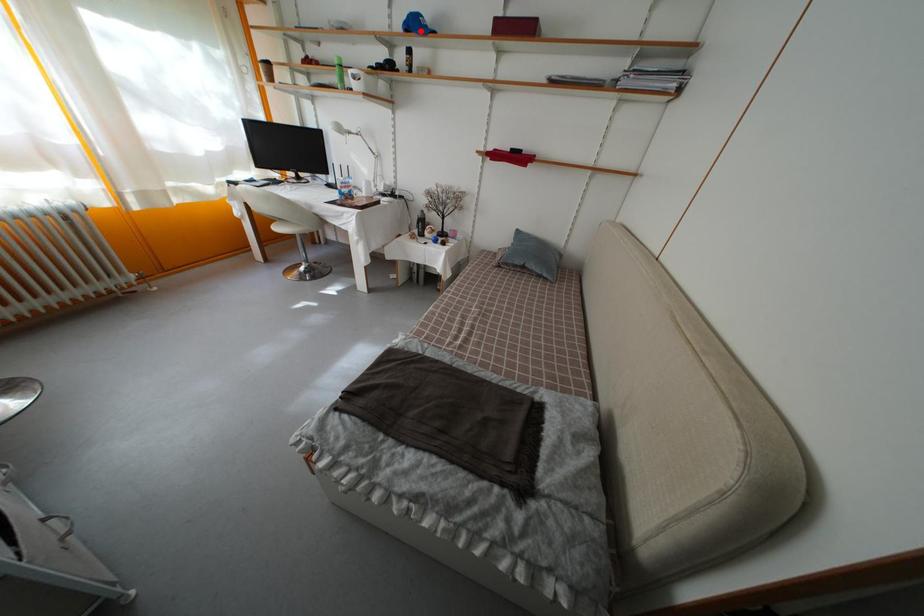
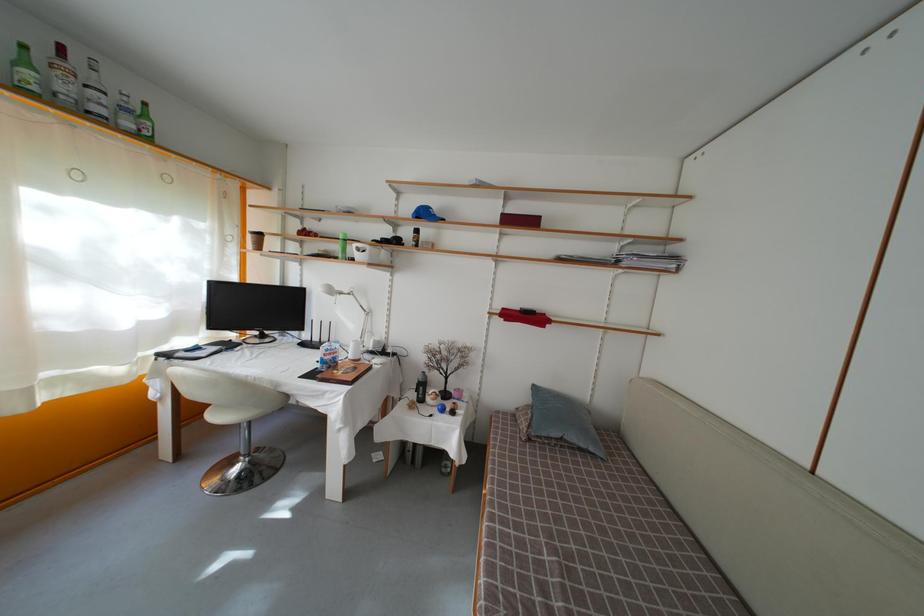
Where in the second image is the point corresponding to the highlighted location from the first image?

(430, 220)